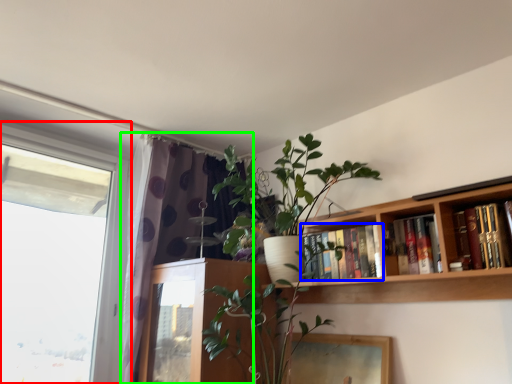
Question: Estimate the real-world distances between objects in this image. Which object is farther from window (highlighted by a red box), book (highlighted by a blue box) or curtain (highlighted by a green box)?

Choices:
 (A) book
 (B) curtain

Answer: (A)